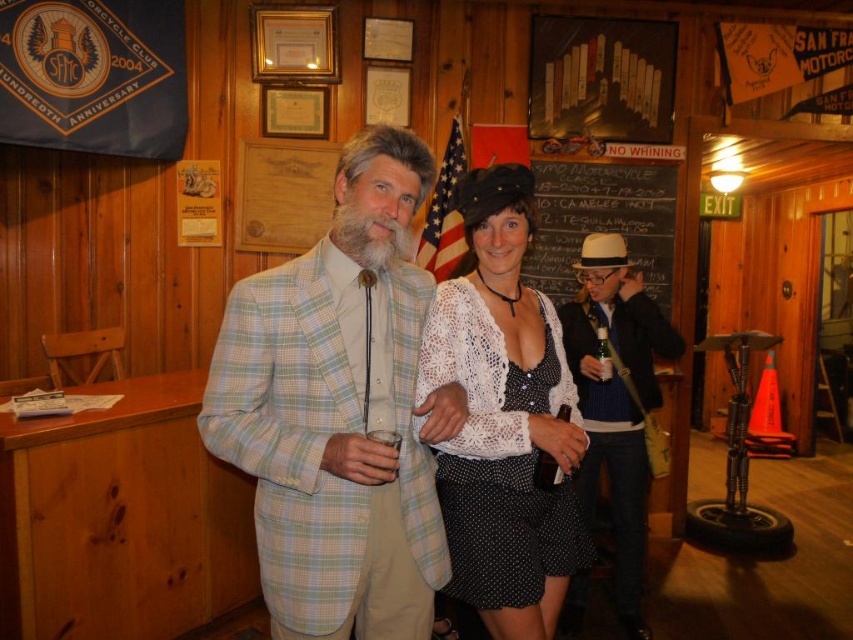
Question: Among these points, which one is nearest to the camera?

Choices:
 (A) (579, 604)
 (B) (283, 512)
 (C) (349, 196)

Answer: (C)

Question: Can you confirm if knitted sweater at center is positioned to the right of black chalkboard at upper center?

Choices:
 (A) yes
 (B) no

Answer: (B)

Question: Does light blue plaid suit at center appear under black chalkboard at upper center?

Choices:
 (A) no
 (B) yes

Answer: (B)

Question: Based on their relative distances, which object is farther from the light blue plaid suit at center?

Choices:
 (A) knitted sweater at center
 (B) black dotted fabric dress at center
 (C) black chalkboard at upper center

Answer: (C)

Question: Is light blue plaid suit at center thinner than knitted sweater at center?

Choices:
 (A) no
 (B) yes

Answer: (A)

Question: Which of the following is the closest to the observer?

Choices:
 (A) (416, 136)
 (B) (643, 529)
 (C) (460, 593)

Answer: (A)